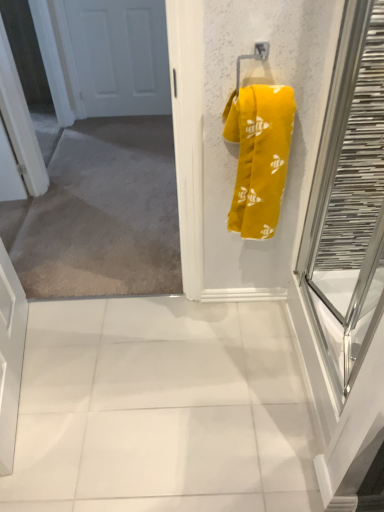
Identify the location of vacant space underneath yellow fabric towel at upper right (from a real-world perspective). (249, 314).